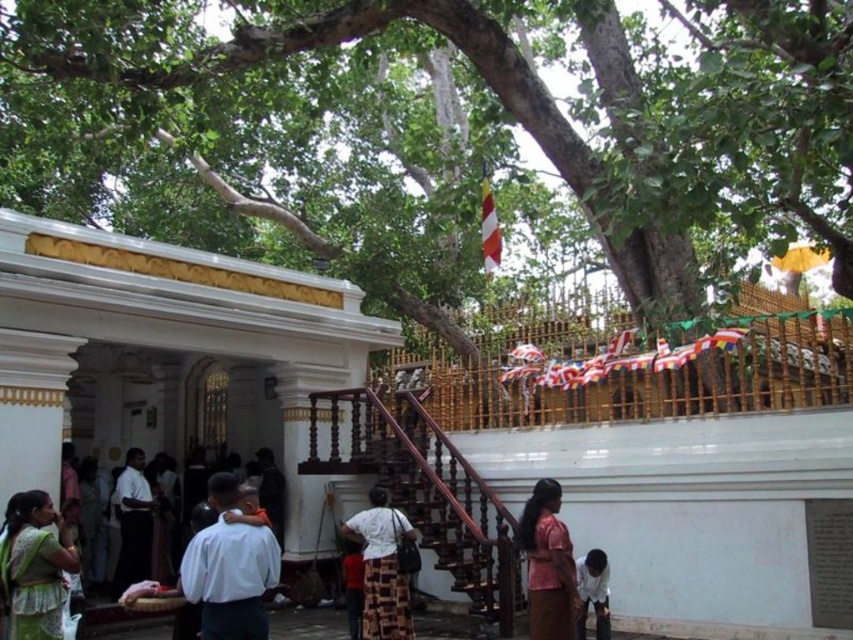
Question: Is matte pink dress at center below white matte shirt at lower right?

Choices:
 (A) yes
 (B) no

Answer: (B)

Question: Can you confirm if white woven fabric at center is positioned above matte pink dress at center?

Choices:
 (A) yes
 (B) no

Answer: (B)

Question: Does green fabric saree at lower left appear under white woven fabric at center?

Choices:
 (A) yes
 (B) no

Answer: (B)

Question: Which point appears farthest from the camera in this image?

Choices:
 (A) (607, 60)
 (B) (56, 632)

Answer: (A)

Question: Which object is farther from the camera taking this photo?

Choices:
 (A) white matte shirt at lower right
 (B) green fabric saree at lower left

Answer: (A)

Question: Which of these objects is positioned farthest from the green leafy tree at upper center?

Choices:
 (A) green fabric saree at lower left
 (B) brown wooden stairs at center
 (C) matte pink dress at center
 (D) white matte shirt at lower right

Answer: (A)